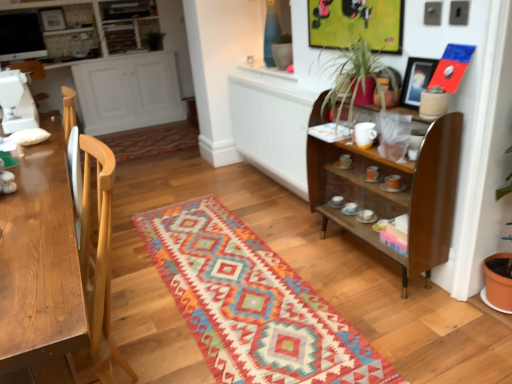
Question: Is green leafy plant at upper center completely or partially inside light wood desk at left?

Choices:
 (A) no
 (B) yes

Answer: (A)

Question: Is light wood desk at left positioned in front of green leafy plant at upper center?

Choices:
 (A) yes
 (B) no

Answer: (A)

Question: Is light wood desk at left facing away from green leafy plant at upper center?

Choices:
 (A) no
 (B) yes

Answer: (A)

Question: From a real-world perspective, is light wood desk at left physically below green leafy plant at upper center?

Choices:
 (A) no
 (B) yes

Answer: (B)

Question: Is light wood desk at left at the left side of green leafy plant at upper center?

Choices:
 (A) yes
 (B) no

Answer: (B)

Question: From a real-world perspective, relative to white wood cabinet at left, which ranks as the first cabinetry in bottom-to-top order, is matte black picture frame at upper right vertically above or below?

Choices:
 (A) below
 (B) above

Answer: (B)

Question: From the image's perspective, is matte black picture frame at upper right positioned above or below white wood cabinet at left, which is the second cabinetry in top-to-bottom order?

Choices:
 (A) below
 (B) above

Answer: (A)

Question: Considering their positions, is matte black picture frame at upper right located in front of or behind white wood cabinet at left, which is the second cabinetry in top-to-bottom order?

Choices:
 (A) front
 (B) behind

Answer: (A)

Question: In the image, is matte black picture frame at upper right on the left side or the right side of white wood cabinet at left, which is the second cabinetry in top-to-bottom order?

Choices:
 (A) left
 (B) right

Answer: (B)

Question: Would you say white glossy cabinet at upper left, acting as the first cabinetry starting from the top, is inside or outside white wood cabinet at left, which is the second cabinetry in top-to-bottom order?

Choices:
 (A) inside
 (B) outside

Answer: (B)

Question: From their relative heights in the image, would you say white glossy cabinet at upper left, acting as the first cabinetry starting from the top, is taller or shorter than white wood cabinet at left, which is the second cabinetry in top-to-bottom order?

Choices:
 (A) short
 (B) tall

Answer: (A)

Question: Would you say white glossy cabinet at upper left, acting as the first cabinetry starting from the top, is to the left or to the right of white wood cabinet at left, which ranks as the first cabinetry in bottom-to-top order, in the picture?

Choices:
 (A) right
 (B) left

Answer: (B)

Question: In terms of width, does white glossy cabinet at upper left, acting as the first cabinetry starting from the top, look wider or thinner when compared to white wood cabinet at left, which is the second cabinetry in top-to-bottom order?

Choices:
 (A) thin
 (B) wide

Answer: (A)

Question: Considering their positions, is white wood cabinet at left, which is the second cabinetry in top-to-bottom order, located in front of or behind green leafy plant at upper right?

Choices:
 (A) front
 (B) behind

Answer: (B)

Question: In terms of height, does white wood cabinet at left, which ranks as the first cabinetry in bottom-to-top order, look taller or shorter compared to green leafy plant at upper right?

Choices:
 (A) short
 (B) tall

Answer: (B)